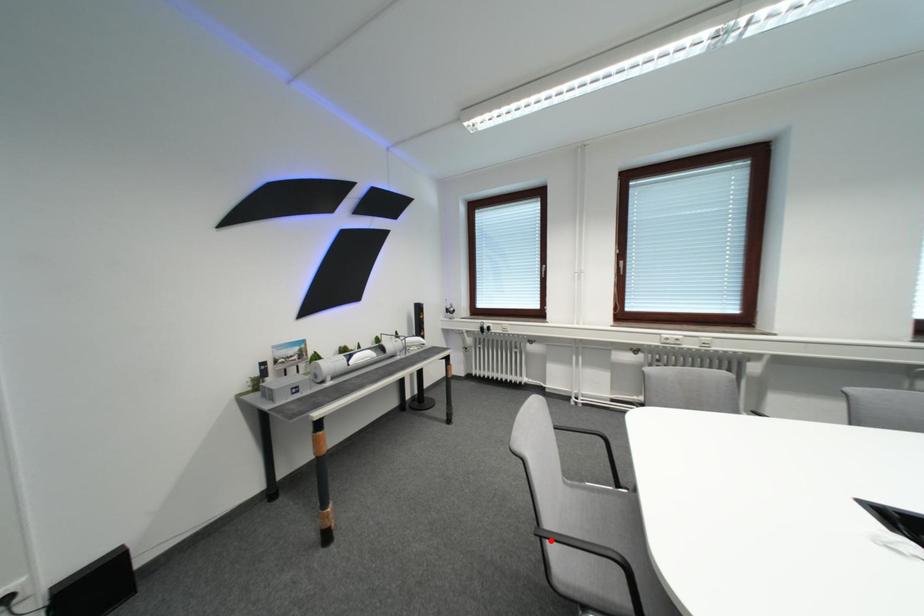
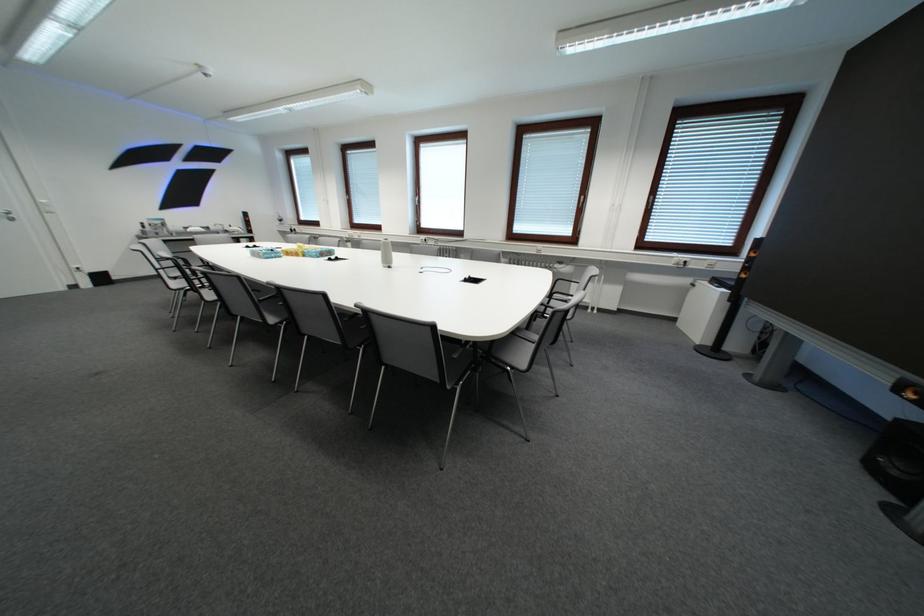
Question: I am providing you with two images of the same scene from different viewpoints. A red point is marked on the first image. At the location where the point appears in image 1, is it still visible in image 2?

Choices:
 (A) Yes
 (B) No

Answer: (B)